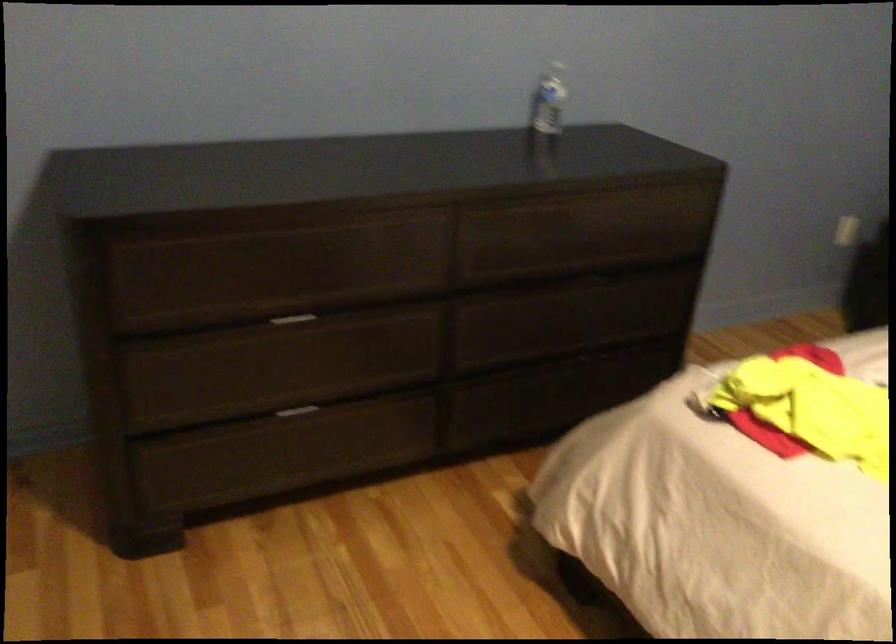
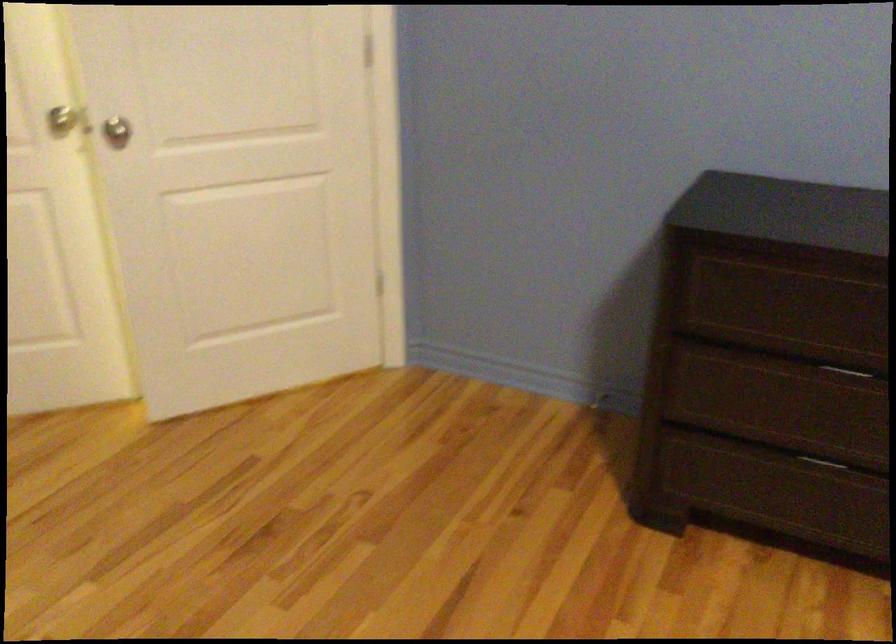
The point at (x=286, y=413) is marked in the first image. Where is the corresponding point in the second image?

(821, 462)